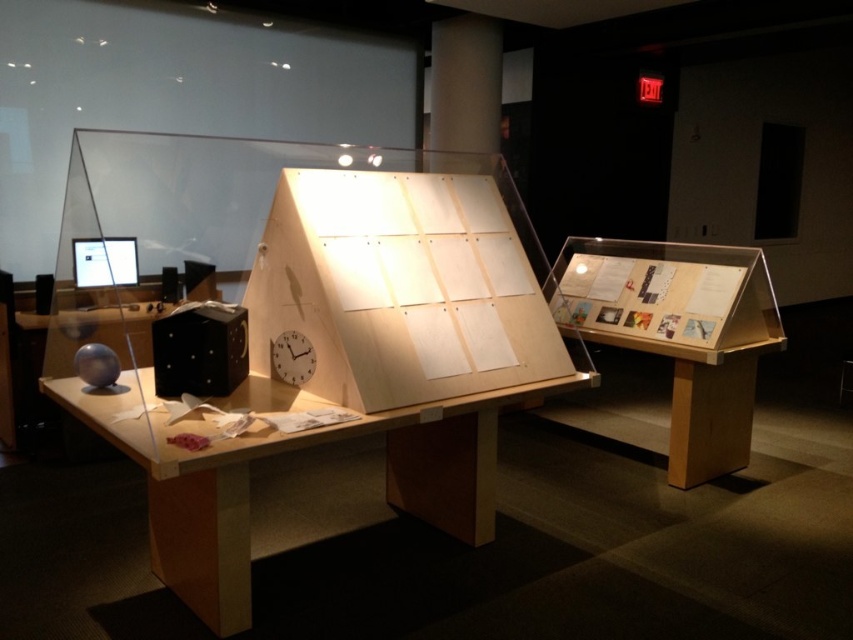
You are standing in the museum and want to locate the point at coordinates [682,333]. Based on the scene description, which object is this point located on?

The point at coordinates [682,333] is located on the wooden display case at right.

Looking at this image, you are standing in the museum and want to take a photo of both the triangular display structure and the other display to the right. You notice two points marked on the floor at coordinates point (187, 429) and point (750, 259). Which point should you stand at to ensure both displays are visible in your camera frame?

You should stand at point (187, 429) because it is in front of point (750, 259), providing a better vantage point to see both the triangular display structure and the other display to the right.